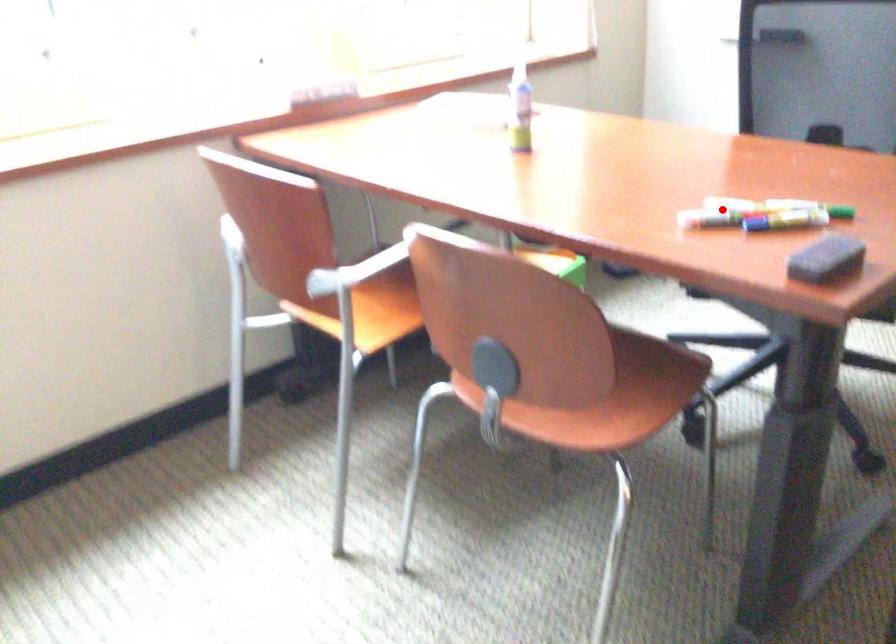
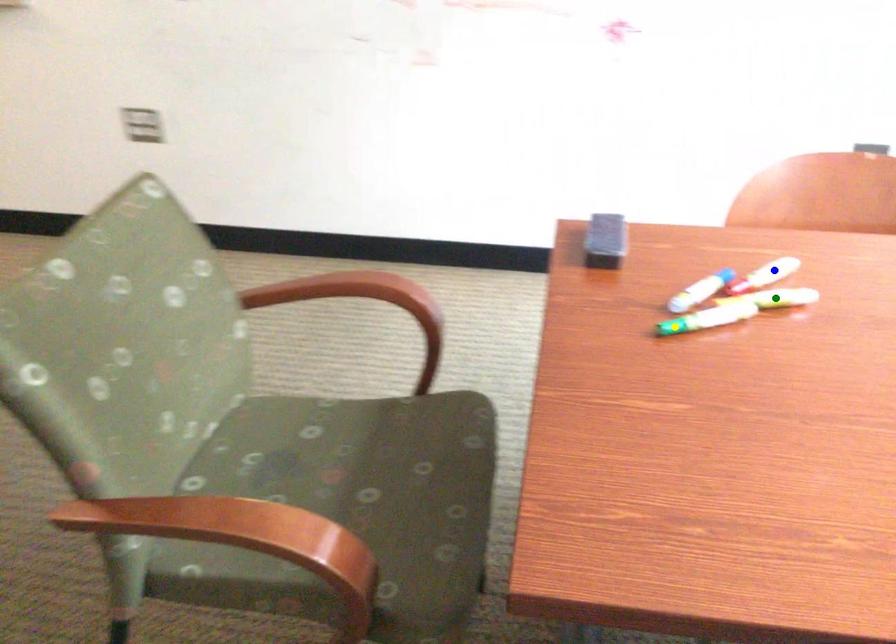
Question: I am providing you with two images of the same scene from different viewpoints. A red point is marked on the first image. You are given multiple points on the second image. Can you choose the point in image 2 that corresponds to the point in image 1?

Choices:
 (A) green point
 (B) yellow point
 (C) blue point

Answer: (A)